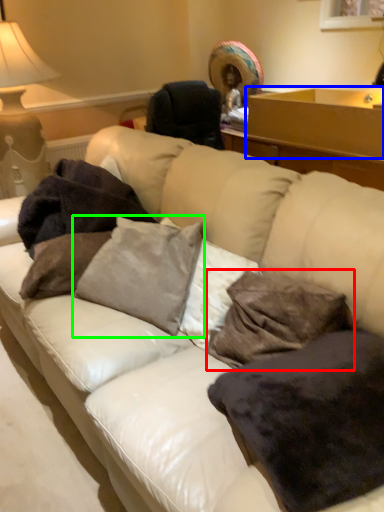
Question: Estimate the real-world distances between objects in this image. Which object is farther from pillow (highlighted by a red box), table (highlighted by a blue box) or pillow (highlighted by a green box)?

Choices:
 (A) table
 (B) pillow

Answer: (A)